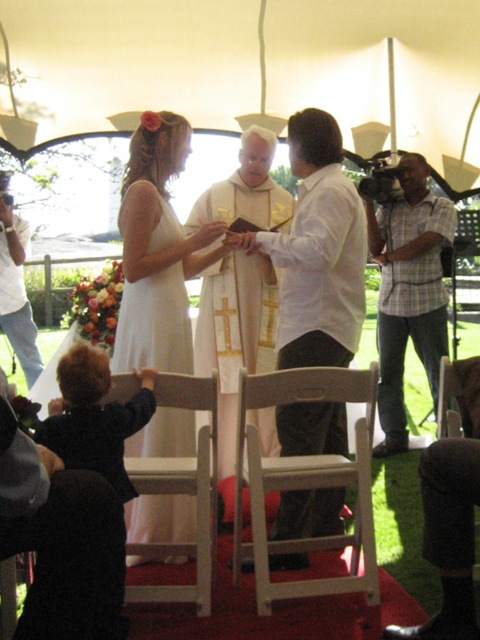
You are a photographer at the wedding ceremony. You need to capture a photo of the white matte shirt at center and the light wood folding chair at center. Which object is taller?

The white matte shirt at center is taller than the light wood folding chair at center.

You are a photographer at the wedding ceremony. You need to capture a photo that includes both the white matte shirt at center and the dark blue fabric at lower left. Based on their positions, which one should you focus on first to ensure both are in frame?

The white matte shirt at center is located above the dark blue fabric at lower left, so you should focus on the dark blue fabric at lower left first to ensure both are in frame.

From the picture: You are a photographer at the wedding ceremony. You need to position yourself so that both the point at coordinates point (300, 428) and the point at coordinates point (117, 442) are visible in your shot. Which point is closer to you and should be framed first?

Point (300, 428) is closer to you than point (117, 442), so you should frame it first to ensure both points are in the shot.